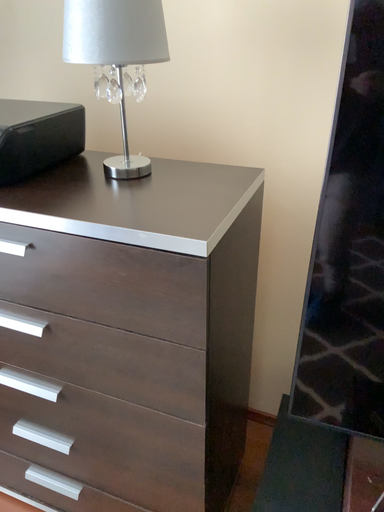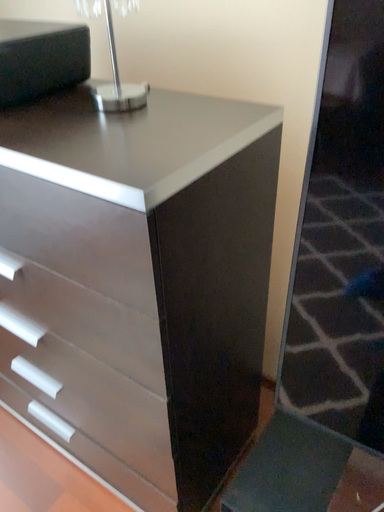
Question: Which way did the camera rotate in the video?

Choices:
 (A) rotated right
 (B) rotated left

Answer: (B)